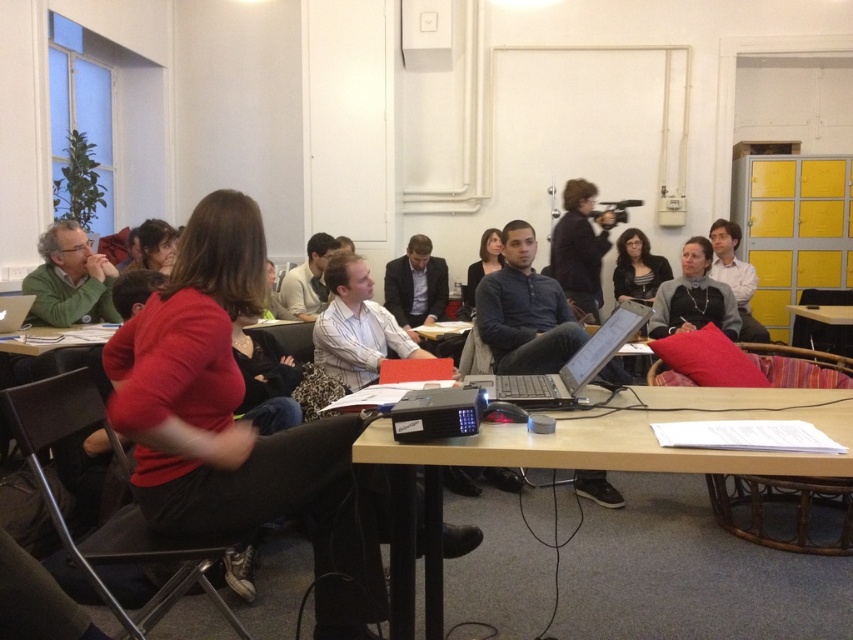
Question: Does silver metallic laptop at center have a lesser width compared to matte gray sweater at center?

Choices:
 (A) yes
 (B) no

Answer: (A)

Question: Which object is closer to the camera taking this photo?

Choices:
 (A) green matte sweater at left
 (B) matte black projector at center
 (C) silver metallic laptop at center
 (D) matte black laptop at left

Answer: (B)

Question: Based on their relative distances, which object is farther from the wooden table at center?

Choices:
 (A) matte black projector at center
 (B) silver metallic laptop at center

Answer: (A)

Question: Which point appears closest to the camera in this image?

Choices:
 (A) pos(692,305)
 (B) pos(372,445)

Answer: (B)

Question: Is silver metallic laptop at center in front of wooden table at center?

Choices:
 (A) no
 (B) yes

Answer: (B)

Question: Can you confirm if silver metallic laptop at center is thinner than wooden table at center?

Choices:
 (A) no
 (B) yes

Answer: (B)